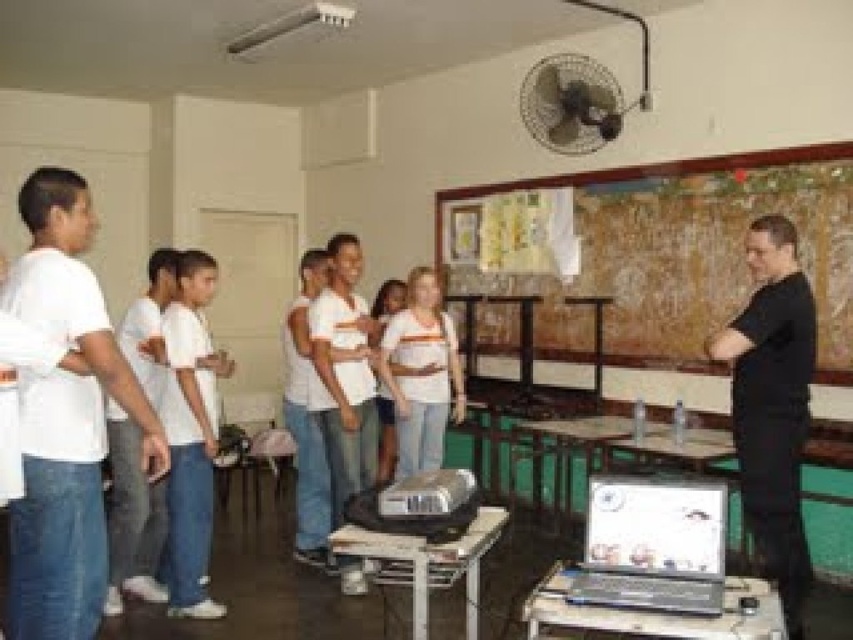
What is located at the coordinate point (65,419) in the image?

The white cotton shirt at left is located at the coordinate point (65,419).

You are standing in the classroom and need to locate the white cotton shirt at left. According to the coordinates provided, where exactly should you look?

The white cotton shirt at left is located at point coordinates 0.655 in the x axis and 0.077 in the y axis.